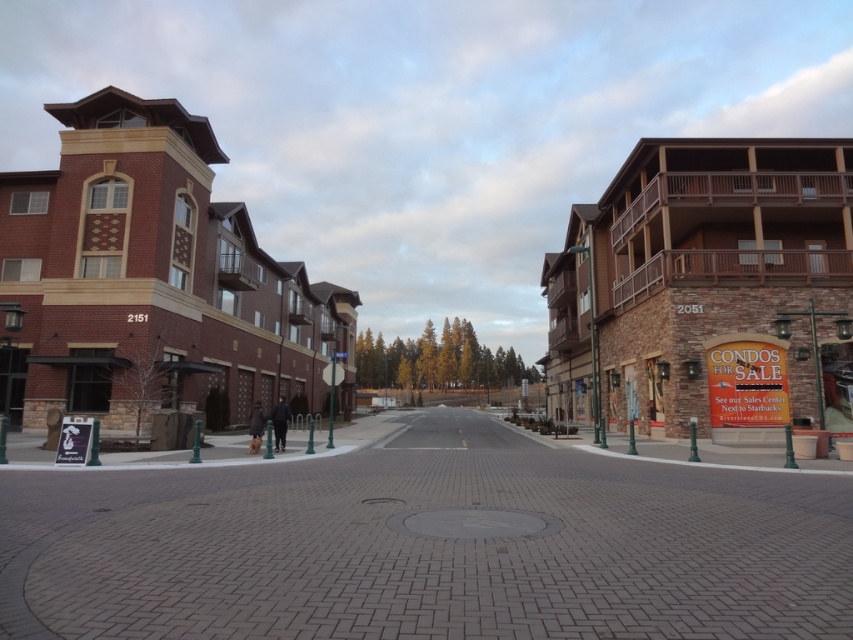
Question: Among these points, which one is nearest to the camera?

Choices:
 (A) (548, 301)
 (B) (173, 349)

Answer: (B)

Question: Observing the image, what is the correct spatial positioning of brick building at left in reference to brown stone building at right?

Choices:
 (A) above
 (B) below

Answer: (A)

Question: Is brick building at center to the left of brick building at left from the viewer's perspective?

Choices:
 (A) yes
 (B) no

Answer: (B)

Question: Is brick building at center behind brown stone building at right?

Choices:
 (A) yes
 (B) no

Answer: (B)

Question: Which point is closer to the camera taking this photo?

Choices:
 (A) (103, 394)
 (B) (141, 348)
 (C) (607, 216)

Answer: (B)

Question: Which object is farther from the camera taking this photo?

Choices:
 (A) brick building at left
 (B) brown stone building at right
 (C) brick building at center

Answer: (A)